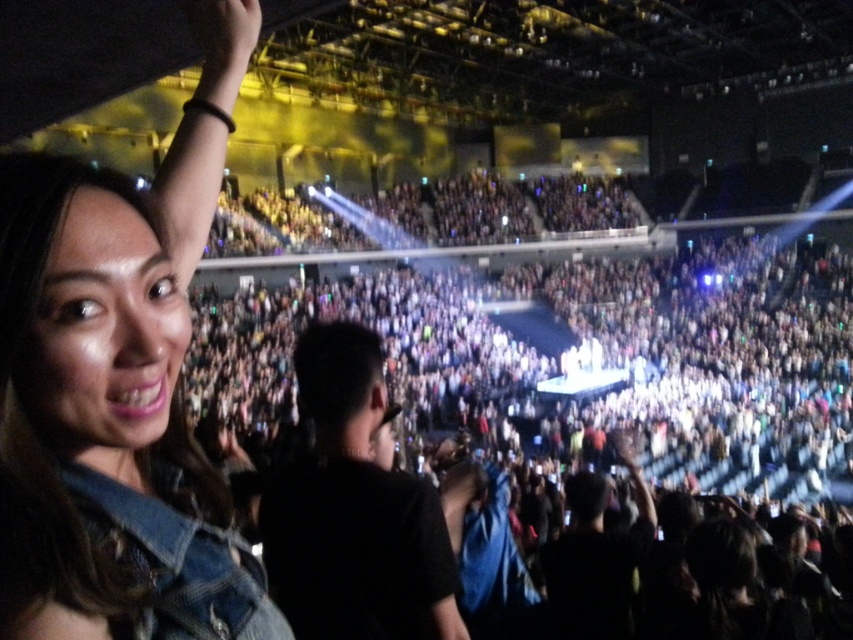
Between point (28, 340) and point (321, 339), which one is positioned in front?

Point (28, 340)

Between point (9, 168) and point (340, 552), which one is positioned behind?

The point (340, 552) is behind.

The width and height of the screenshot is (853, 640). What do you see at coordinates (117, 387) in the screenshot?
I see `denim jacket at upper left` at bounding box center [117, 387].

At what (x,y) coordinates should I click in order to perform the action: click on denim jacket at upper left. Please return your answer as a coordinate pair (x, y). This screenshot has height=640, width=853. Looking at the image, I should click on (117, 387).

Is dark gray fabric crowd at center to the left of black matte shirt at center from the viewer's perspective?

In fact, dark gray fabric crowd at center is to the right of black matte shirt at center.

Is dark gray fabric crowd at center behind black matte shirt at center?

Yes, dark gray fabric crowd at center is further from the viewer.

Measure the distance between point (776, 412) and camera.

They are 70.42 meters apart.

The height and width of the screenshot is (640, 853). What are the coordinates of `dark gray fabric crowd at center` in the screenshot? It's located at (583, 358).

Between dark gray fabric crowd at center and denim jacket at upper left, which one has less height?

Standing shorter between the two is denim jacket at upper left.

Does dark gray fabric crowd at center have a lesser width compared to denim jacket at upper left?

Incorrect, dark gray fabric crowd at center's width is not less than denim jacket at upper left's.

What do you see at coordinates (583, 358) in the screenshot? I see `dark gray fabric crowd at center` at bounding box center [583, 358].

In order to click on dark gray fabric crowd at center in this screenshot , I will do `click(583, 358)`.